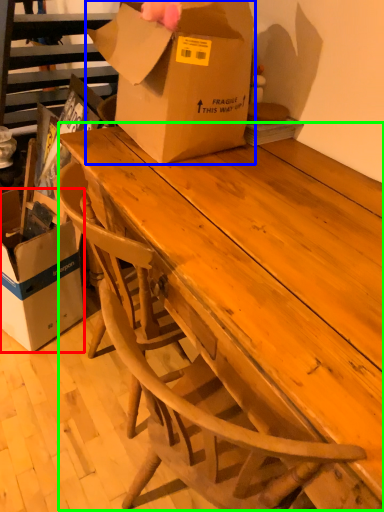
Question: Estimate the real-world distances between objects in this image. Which object is closer to box (highlighted by a red box), box (highlighted by a blue box) or table (highlighted by a green box)?

Choices:
 (A) box
 (B) table

Answer: (A)